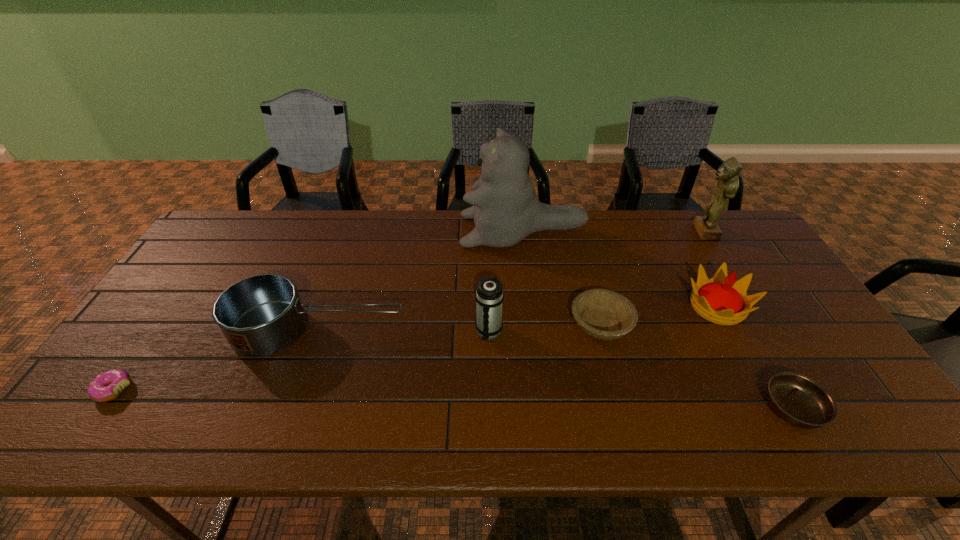
This screenshot has height=540, width=960. I want to click on object situated at the near right corner, so [x=797, y=399].

At what (x,y) coordinates should I click in order to perform the action: click on free space at the far edge of the desktop. Please return your answer as a coordinate pair (x, y). This screenshot has height=540, width=960. Looking at the image, I should click on 528,246.

The width and height of the screenshot is (960, 540). I want to click on blank area at the left edge, so click(214, 265).

Where is `vacant space at the right edge of the desktop`? vacant space at the right edge of the desktop is located at coordinates (765, 263).

The width and height of the screenshot is (960, 540). In order to click on free space at the far right corner in this screenshot , I will do `click(713, 245)`.

Where is `free space between the tallest object and the crown`? free space between the tallest object and the crown is located at coordinates (620, 269).

This screenshot has height=540, width=960. I want to click on free spot between the thermos bottle and the second shortest object, so click(640, 370).

The image size is (960, 540). In order to click on blank region between the sixth shortest object and the fourth shortest object in this screenshot , I will do `click(404, 331)`.

Where is `free area in between the doughnut and the bowl`? The image size is (960, 540). free area in between the doughnut and the bowl is located at coordinates (357, 357).

Where is `vacant space that's between the seventh shortest object and the sixth tallest object`? The height and width of the screenshot is (540, 960). vacant space that's between the seventh shortest object and the sixth tallest object is located at coordinates (652, 278).